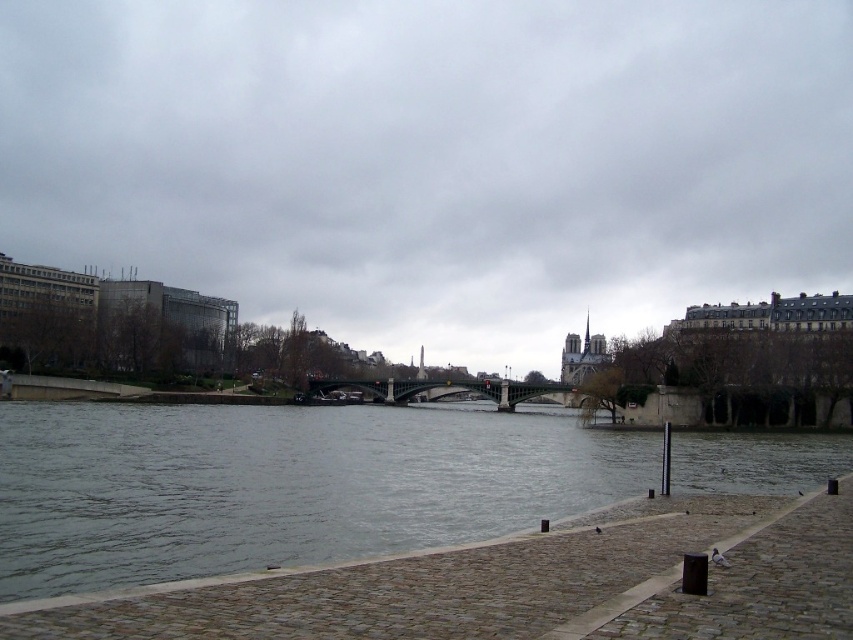
Question: Is cloudy sky at upper center thinner than green metallic bridge at center?

Choices:
 (A) no
 (B) yes

Answer: (A)

Question: Among these objects, which one is nearest to the camera?

Choices:
 (A) cloudy sky at upper center
 (B) green metallic bridge at center

Answer: (A)

Question: Which object is farther from the camera taking this photo?

Choices:
 (A) cloudy sky at upper center
 (B) green metallic bridge at center

Answer: (B)

Question: Is gray water at center above green metallic bridge at center?

Choices:
 (A) yes
 (B) no

Answer: (A)

Question: Does gray water at center appear under green metallic bridge at center?

Choices:
 (A) no
 (B) yes

Answer: (A)

Question: Which object is the closest to the green metallic bridge at center?

Choices:
 (A) cloudy sky at upper center
 (B) gray water at center

Answer: (B)